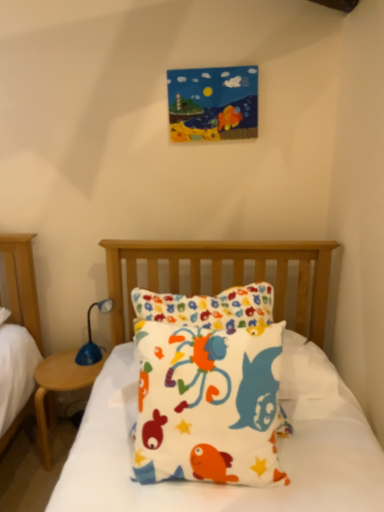
The image size is (384, 512). I want to click on vacant area that is in front of blue plastic table lamp at left, so click(x=77, y=376).